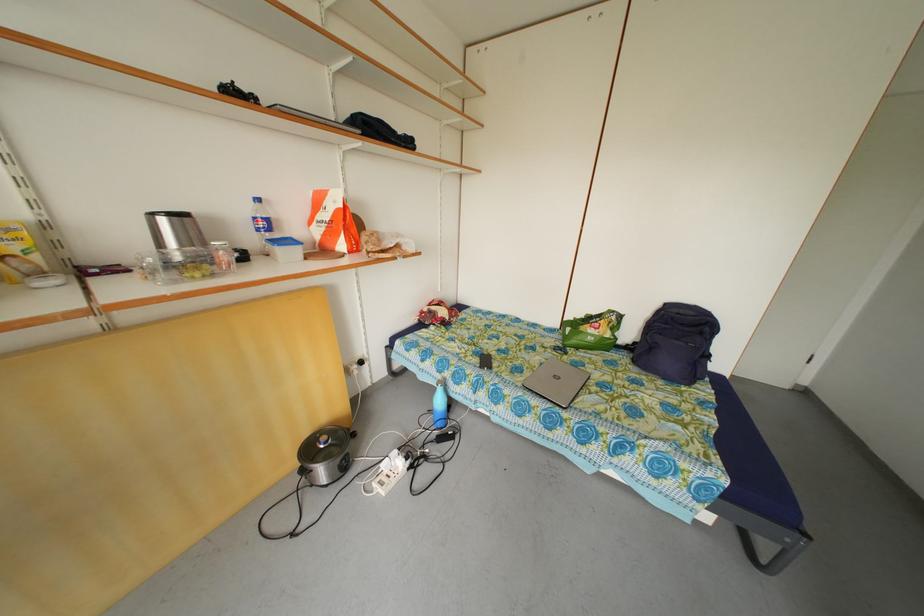
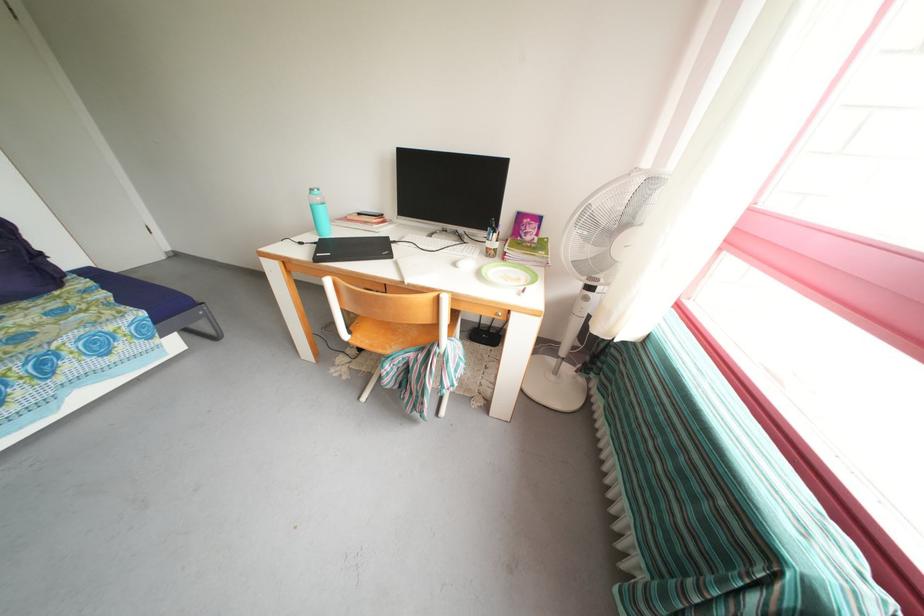
Where in the second image is the point corresponding to point (707, 376) from the first image?

(55, 276)